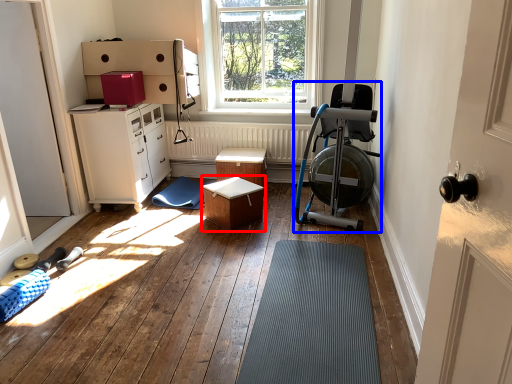
Question: Which object appears closest to the camera in this image, table (highlighted by a red box) or baby carriage (highlighted by a blue box)?

Choices:
 (A) table
 (B) baby carriage

Answer: (B)